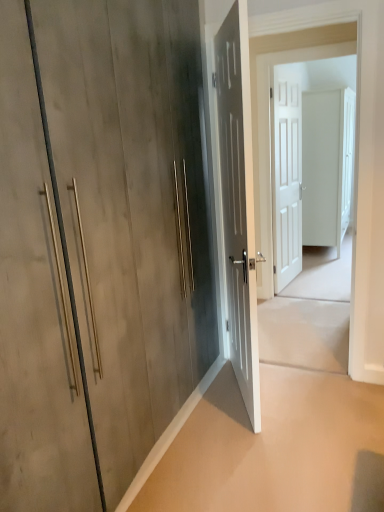
This screenshot has height=512, width=384. Find the location of `white matte door at center`. white matte door at center is located at coordinates (308, 160).

Identify the location of white matte door at center, which ranks as the 1th door in right-to-left order. (327, 166).

Measure the distance between point (x=234, y=364) and camera.

Point (x=234, y=364) and camera are 2.78 meters apart from each other.

Find the location of a particular element. This screenshot has width=384, height=512. matte wood door at center, the first door positioned from the left is located at coordinates (132, 209).

Would you say beige concrete at lower right is part of matte gray door at center, which is the 2th door in front-to-back order,'s contents?

No, beige concrete at lower right is not inside matte gray door at center, which is the 2th door in front-to-back order.

Considering the positions of points (237, 45) and (324, 495), is point (237, 45) closer to camera compared to point (324, 495)?

No, (237, 45) is further to viewer.

Considering the positions of objects matte gray door at center, which appears as the 3th door when viewed from the right, and beige concrete at lower right in the image provided, who is more to the left, matte gray door at center, which appears as the 3th door when viewed from the right, or beige concrete at lower right?

Positioned to the left is matte gray door at center, which appears as the 3th door when viewed from the right.

Is matte wood door at center, which is counted as the first door, starting from the front, positioned with its back to white matte door at center, the 3th door when ordered from front to back?

No, matte wood door at center, which is counted as the first door, starting from the front,'s orientation is not away from white matte door at center, the 3th door when ordered from front to back.

There is a matte wood door at center, which is counted as the first door, starting from the front. Where is `the 1st door below it (from a real-world perspective)`? The width and height of the screenshot is (384, 512). the 1st door below it (from a real-world perspective) is located at coordinates (286, 180).

Between matte wood door at center, the first door positioned from the left, and white matte door at center, the 2th door positioned from the right, which one has larger size?

matte wood door at center, the first door positioned from the left, is bigger.

From the image's perspective, would you say matte wood door at center, the first door positioned from the left, is positioned over white matte door at center, the 3th door from the left?

No.

Is white matte door at center, the 2th door positioned from the right, not inside white matte door at center, acting as the 4th door starting from the left?

Yes, white matte door at center, the 2th door positioned from the right, is located beyond the bounds of white matte door at center, acting as the 4th door starting from the left.

Could you tell me if white matte door at center, the 3th door when ordered from front to back, is facing white matte door at center, acting as the 4th door starting from the left?

No, white matte door at center, the 3th door when ordered from front to back, is not facing towards white matte door at center, acting as the 4th door starting from the left.

Does white matte door at center, the 3th door when ordered from front to back, touch white matte door at center, which ranks as the 1th door in right-to-left order?

No.

Is point (284, 166) behind point (352, 161)?

Yes, point (284, 166) is farther from viewer.

Can you confirm if matte gray door at center, positioned as the 3th door in back-to-front order, is positioned to the left of white matte door at center, the 2th door viewed from the back?

Correct, you'll find matte gray door at center, positioned as the 3th door in back-to-front order, to the left of white matte door at center, the 2th door viewed from the back.

From a real-world perspective, between matte gray door at center, which appears as the 3th door when viewed from the right, and white matte door at center, the 3th door when ordered from front to back, who is vertically lower?

matte gray door at center, which appears as the 3th door when viewed from the right.

Is white matte door at center, the 2th door positioned from the right, inside matte gray door at center, which appears as the 2th door when viewed from the left?

No, white matte door at center, the 2th door positioned from the right, is located outside of matte gray door at center, which appears as the 2th door when viewed from the left.

Is matte gray door at center, which is the 2th door in front-to-back order, facing towards white matte door at center, the 2th door viewed from the back?

No, matte gray door at center, which is the 2th door in front-to-back order, does not turn towards white matte door at center, the 2th door viewed from the back.

Is white matte door at center, the 3th door when ordered from front to back, at the left side of matte wood door at center, the first door positioned from the left?

Incorrect, white matte door at center, the 3th door when ordered from front to back, is not on the left side of matte wood door at center, the first door positioned from the left.

Is matte wood door at center, the first door positioned from the left, at the back of white matte door at center, the 2th door positioned from the right?

white matte door at center, the 2th door positioned from the right, does not have its back to matte wood door at center, the first door positioned from the left.

The height and width of the screenshot is (512, 384). I want to click on the 2nd door counting from the right side of the matte wood door at center, which is the 4th door from back to front, so click(286, 180).

Is white matte door at center, the 2th door viewed from the back, next to matte wood door at center, the first door positioned from the left?

→ No, white matte door at center, the 2th door viewed from the back, is not touching matte wood door at center, the first door positioned from the left.

From a real-world perspective, does matte wood door at center, arranged as the fourth door when viewed from the right, stand above matte gray door at center, positioned as the 3th door in back-to-front order?

Indeed, from a real-world perspective, matte wood door at center, arranged as the fourth door when viewed from the right, stands above matte gray door at center, positioned as the 3th door in back-to-front order.

How different are the orientations of matte wood door at center, the first door positioned from the left, and matte gray door at center, which is the 2th door in front-to-back order, in degrees?

There is a 25.5-degree angle between the facing directions of matte wood door at center, the first door positioned from the left, and matte gray door at center, which is the 2th door in front-to-back order.

Considering the positions of objects matte wood door at center, which is the 4th door from back to front, and matte gray door at center, which appears as the 3th door when viewed from the right, in the image provided, who is more to the right, matte wood door at center, which is the 4th door from back to front, or matte gray door at center, which appears as the 3th door when viewed from the right,?

matte gray door at center, which appears as the 3th door when viewed from the right.

Is point (128, 243) less distant than point (243, 161)?

Yes, it is.

Can you confirm if matte wood door at center, arranged as the fourth door when viewed from the right, is positioned to the right of white matte door at center?

Incorrect, matte wood door at center, arranged as the fourth door when viewed from the right, is not on the right side of white matte door at center.

Is matte wood door at center, the first door positioned from the left, positioned with its back to white matte door at center?

That's not correct — matte wood door at center, the first door positioned from the left, is not looking away from white matte door at center.

From a real-world perspective, is matte wood door at center, which is the 4th door from back to front, physically above white matte door at center?

Yes, from a real-world perspective, matte wood door at center, which is the 4th door from back to front, is on top of white matte door at center.

Find the location of a particular element. This screenshot has height=512, width=384. screen door above the matte wood door at center, the first door positioned from the left (from the image's perspective) is located at coordinates (308, 160).

At what (x,y) coordinates should I click in order to perform the action: click on concrete in front of the matte gray door at center, which appears as the 2th door when viewed from the left. Please return your answer as a coordinate pair (x, y). Looking at the image, I should click on (275, 448).

The height and width of the screenshot is (512, 384). I want to click on door that is the 1st object directly below the matte wood door at center, which is the 4th door from back to front (from a real-world perspective), so click(286, 180).

Considering their positions, is matte gray door at center, positioned as the 3th door in back-to-front order, positioned closer to white matte door at center, the 3th door when ordered from front to back, than white matte door at center?

white matte door at center is closer to white matte door at center, the 3th door when ordered from front to back.

Based on their spatial positions, is matte wood door at center, which is the 4th door from back to front, or matte gray door at center, which is the 2th door in front-to-back order, further from white matte door at center?

Based on the image, matte wood door at center, which is the 4th door from back to front, appears to be further to white matte door at center.

Considering their positions, is white matte door at center positioned further to matte wood door at center, which is counted as the first door, starting from the front, than matte gray door at center, which appears as the 3th door when viewed from the right?

white matte door at center lies further to matte wood door at center, which is counted as the first door, starting from the front, than the other object.

From the picture: Which object lies further to the anchor point matte wood door at center, which is the 4th door from back to front, white matte door at center, the 2th door viewed from the back, or white matte door at center, acting as the 4th door starting from the left?

white matte door at center, acting as the 4th door starting from the left, is further to matte wood door at center, which is the 4th door from back to front.

Looking at the image, which one is located closer to white matte door at center, the 3th door when ordered from front to back, beige concrete at lower right or white matte door at center?

Among the two, white matte door at center is located nearer to white matte door at center, the 3th door when ordered from front to back.

Considering their positions, is beige concrete at lower right positioned closer to matte gray door at center, positioned as the 3th door in back-to-front order, than white matte door at center, the 2th door positioned from the right?

Among the two, beige concrete at lower right is located nearer to matte gray door at center, positioned as the 3th door in back-to-front order.

From the image, which object appears to be nearer to white matte door at center, white matte door at center, which ranks as the 1th door in right-to-left order, or white matte door at center, the 3th door from the left?

Among the two, white matte door at center, which ranks as the 1th door in right-to-left order, is located nearer to white matte door at center.

Looking at the image, which one is located closer to matte gray door at center, which appears as the 2th door when viewed from the left, beige concrete at lower right or matte wood door at center, arranged as the fourth door when viewed from the right?

Based on the image, beige concrete at lower right appears to be nearer to matte gray door at center, which appears as the 2th door when viewed from the left.

This screenshot has width=384, height=512. Find the location of `door between matte wood door at center, which is the 4th door from back to front, and white matte door at center in the front-back direction`. door between matte wood door at center, which is the 4th door from back to front, and white matte door at center in the front-back direction is located at coordinates (238, 201).

Where is `screen door between beige concrete at lower right and white matte door at center, the 3th door from the left, in the front-back direction`? screen door between beige concrete at lower right and white matte door at center, the 3th door from the left, in the front-back direction is located at coordinates (308, 160).

Where is `door located between beige concrete at lower right and white matte door at center in the depth direction`? The height and width of the screenshot is (512, 384). door located between beige concrete at lower right and white matte door at center in the depth direction is located at coordinates (238, 201).

Where is `screen door between matte gray door at center, which appears as the 2th door when viewed from the left, and white matte door at center, marked as the first door in a back-to-front arrangement, in the front-back direction`? screen door between matte gray door at center, which appears as the 2th door when viewed from the left, and white matte door at center, marked as the first door in a back-to-front arrangement, in the front-back direction is located at coordinates (308, 160).